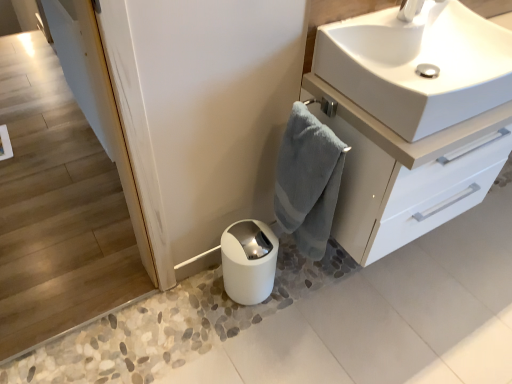
The width and height of the screenshot is (512, 384). What are the coordinates of `vacant space to the right of white glossy toilet paper at lower center` in the screenshot? It's located at (303, 307).